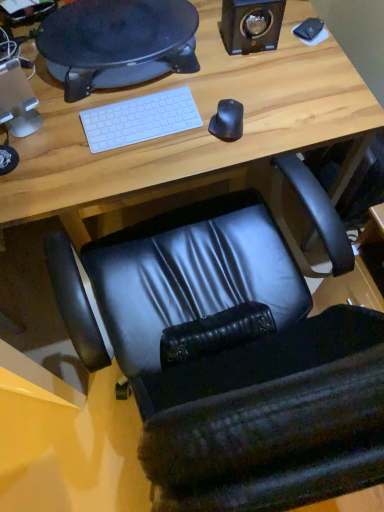
Question: From a real-world perspective, is matte black chair at lower center on black rubber mouse at center?

Choices:
 (A) no
 (B) yes

Answer: (A)

Question: Could you tell me if matte black chair at lower center is facing black rubber mouse at center?

Choices:
 (A) no
 (B) yes

Answer: (A)

Question: Is matte black chair at lower center far away from black rubber mouse at center?

Choices:
 (A) yes
 (B) no

Answer: (B)

Question: Can you confirm if matte black chair at lower center is positioned to the right of black rubber mouse at center?

Choices:
 (A) yes
 (B) no

Answer: (B)

Question: From the image's perspective, does matte black chair at lower center appear higher than black rubber mouse at center?

Choices:
 (A) no
 (B) yes

Answer: (B)

Question: Is matte black chair at lower center directly adjacent to black rubber mouse at center?

Choices:
 (A) no
 (B) yes

Answer: (A)

Question: Could you tell me if black leather chair at center is turned towards black rubber mouse at center?

Choices:
 (A) no
 (B) yes

Answer: (B)

Question: From a real-world perspective, does black leather chair at center stand above black rubber mouse at center?

Choices:
 (A) no
 (B) yes

Answer: (A)

Question: Is black leather chair at center oriented away from black rubber mouse at center?

Choices:
 (A) yes
 (B) no

Answer: (B)

Question: Does black leather chair at center have a greater width compared to black rubber mouse at center?

Choices:
 (A) yes
 (B) no

Answer: (A)

Question: From the image's perspective, is black leather chair at center located beneath black rubber mouse at center?

Choices:
 (A) no
 (B) yes

Answer: (B)

Question: Does black leather chair at center appear on the right side of black rubber mouse at center?

Choices:
 (A) no
 (B) yes

Answer: (A)

Question: Can we say white matte keyboard at center lies outside black leather chair at center?

Choices:
 (A) no
 (B) yes

Answer: (B)